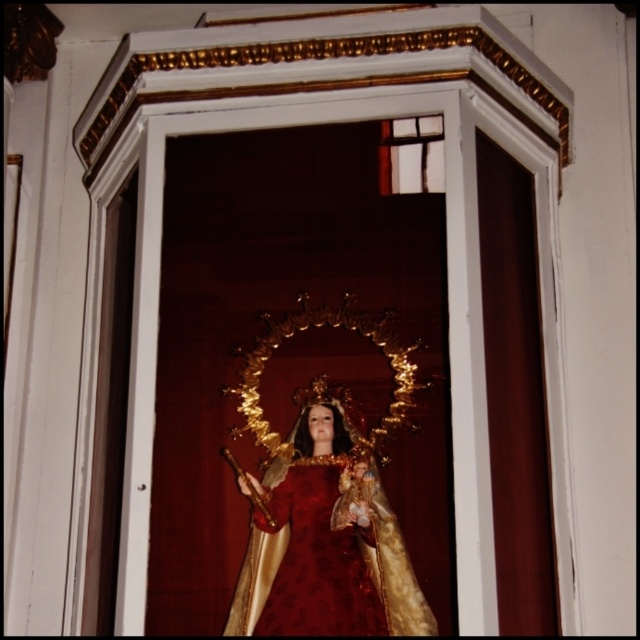
Question: Among these objects, which one is nearest to the camera?

Choices:
 (A) velvet rich red dress at center
 (B) velvet gold statue at center

Answer: (B)

Question: Among these points, which one is farthest from the camera?

Choices:
 (A) (284, 554)
 (B) (417, 628)

Answer: (A)

Question: Is the position of velvet gold statue at center less distant than that of velvet rich red dress at center?

Choices:
 (A) yes
 (B) no

Answer: (A)

Question: Is velvet gold statue at center to the left of velvet rich red dress at center from the viewer's perspective?

Choices:
 (A) yes
 (B) no

Answer: (A)

Question: Observing the image, what is the correct spatial positioning of velvet gold statue at center in reference to velvet rich red dress at center?

Choices:
 (A) right
 (B) left

Answer: (B)

Question: Which point is farther to the camera?

Choices:
 (A) velvet gold statue at center
 (B) velvet rich red dress at center

Answer: (B)